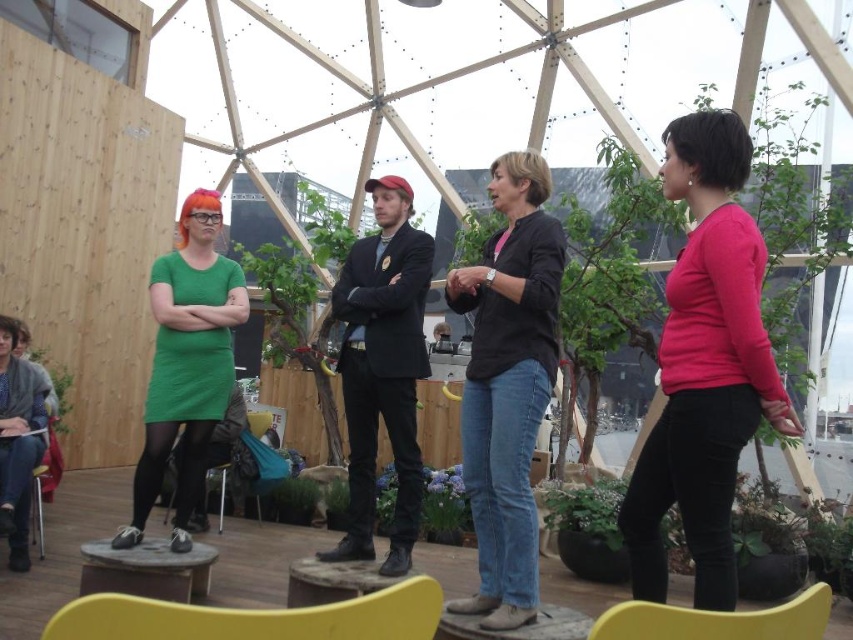
You are standing in front of the stage and want to take a photo. There are two points marked on the stage at coordinates point (662, 621) and point (33, 492). Which point will appear larger in your photo?

Point (662, 621) is closer to the camera than point (33, 492), so it will appear larger in the photo.